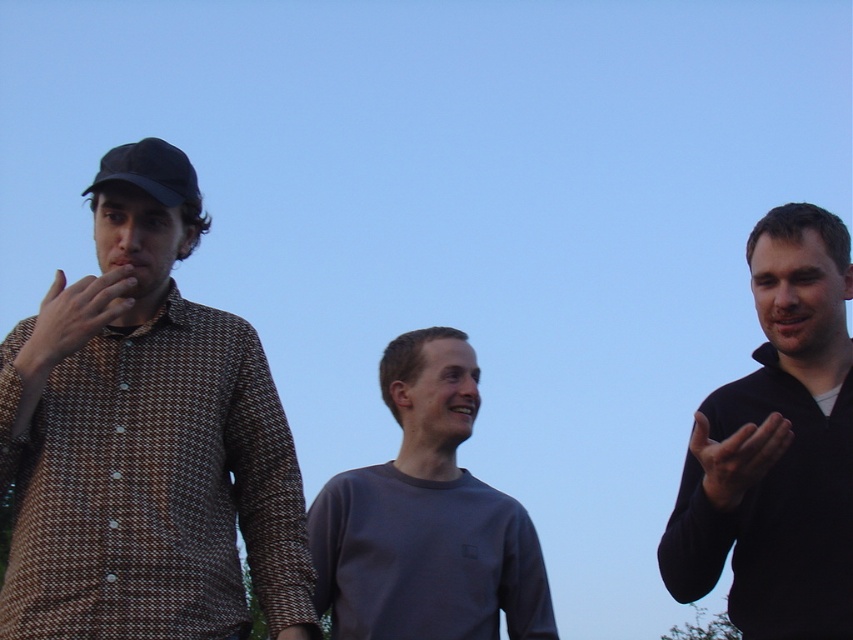
You are trying to decide which item to grab first from the scene. The black matte sweater at right and the black matte baseball cap at left are both within reach. Which item is wider so you can grab it more easily?

The black matte sweater at right is wider than the black matte baseball cap at left, so you can grab it more easily.

You are standing in the scene and want to place a small sticker exactly at the point marked as point (776, 448). Which object should you place it on?

The point (776, 448) is located on the black matte sweater at right, so you should place the sticker there.